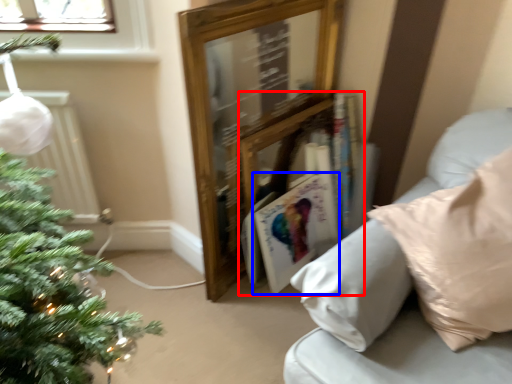
Question: Among these objects, which one is farthest to the camera, book (highlighted by a red box) or magazine (highlighted by a blue box)?

Choices:
 (A) book
 (B) magazine

Answer: (B)